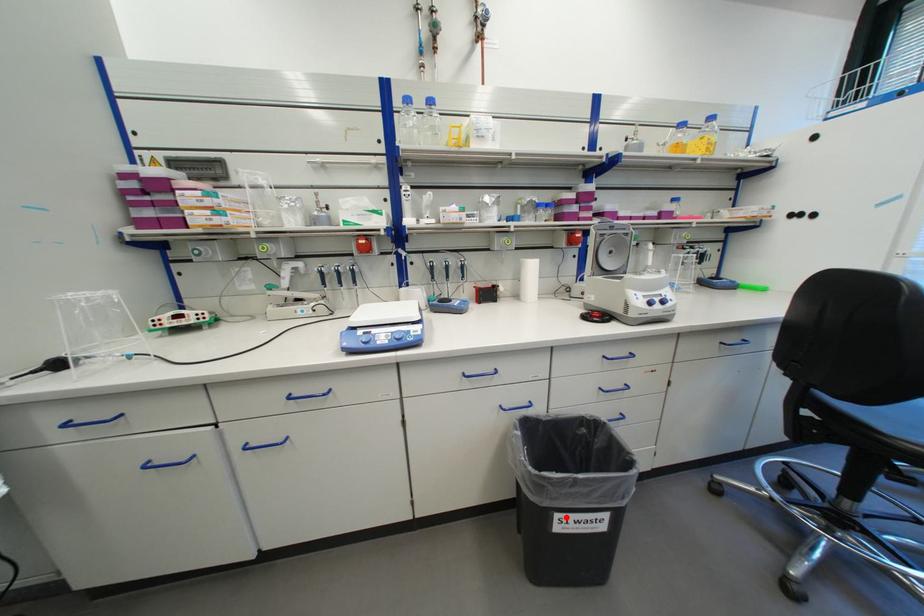
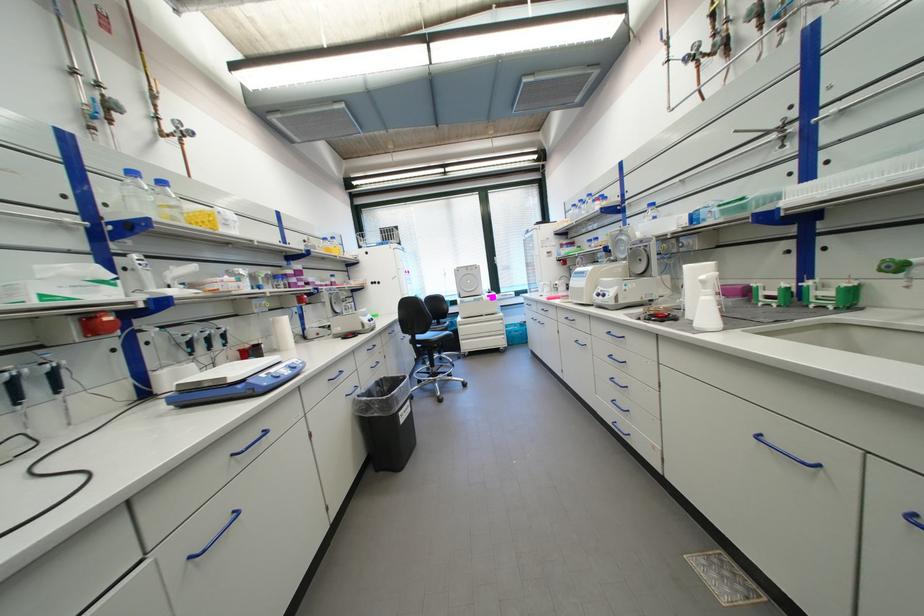
The point at the highlighted location is marked in the first image. Where is the corresponding point in the second image?

(407, 415)